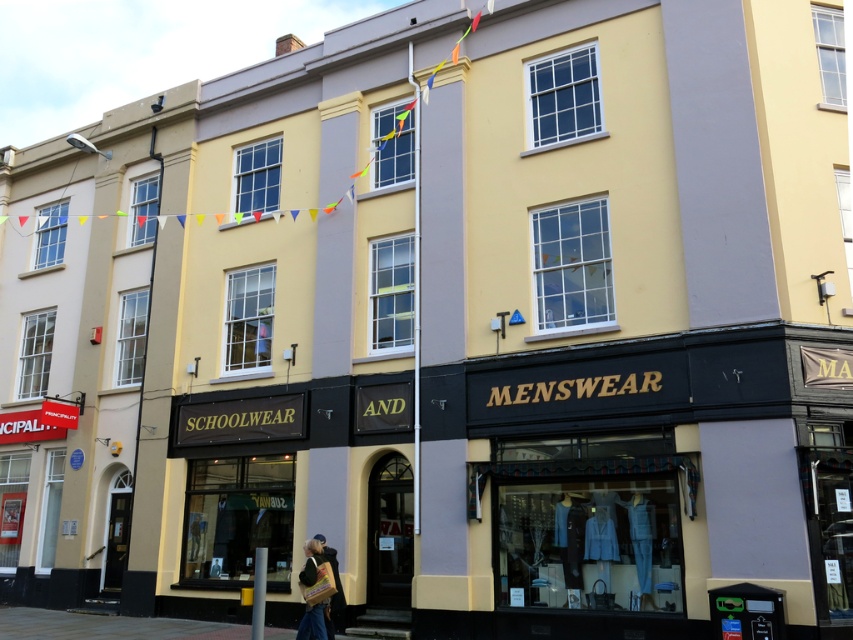
You are a delivery person trying to fit a box that is 1 meter wide through the space between the leather jacket at lower center and the denim jacket at lower center. Can you fit the box through that space?

The leather jacket at lower center might be wider than denim jacket at lower center, so the space between them is uncertain. It is possible that the box may not fit. Please check the actual width before attempting to move the box.

You are standing in front of the two shops. The leather jacket at lower center is located at point [312,621]. Which shop is it in? The SCHOOLWEAR AND shop on the left or the MENSWEAR shop on the right?

The leather jacket at lower center is located in the MENSWEAR shop on the right because the point [312,621] is closer to the right side of the image.